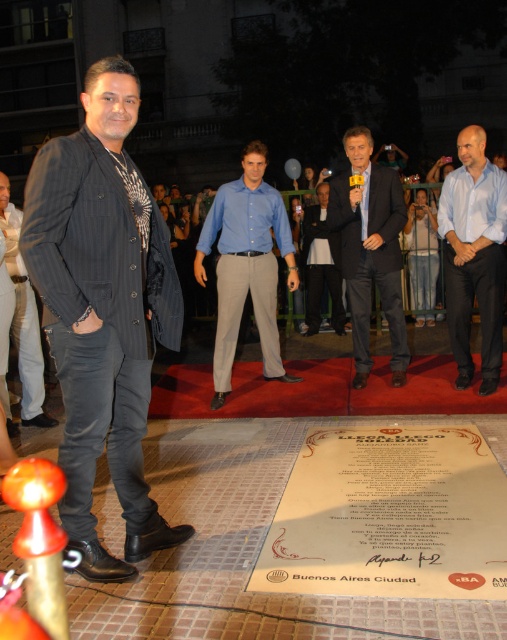
You are a photographer at the event and need to ensure both the blue smooth shirt at center and the dark gray wool suit at center are visible in your photo. Given their sizes, which one might appear larger in the frame?

The blue smooth shirt at center is taller than the dark gray wool suit at center, so it will appear larger in the frame.

You are attending a nighttime event on a red carpet. You notice two items at the center of the scene. Which item is closer to you, the blue cotton shirt at center or the matte black jacket at center?

The blue cotton shirt at center is closer to you because the matte black jacket at center is behind it.

You are a photographer at the event and need to capture a photo that includes both the man in the dark pinstripe suit jacket and the blue cotton shirt at center. The camera you have can only focus on subjects within a 5 meter range. Will you be able to get both subjects in focus?

The man in the dark pinstripe suit jacket and the blue cotton shirt at center are 4.93 meters apart. Since the camera can focus within a 5 meter range, both subjects will be in focus as their distance is within the camera limit.